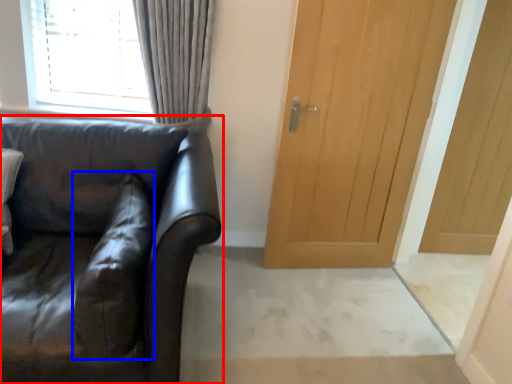
Question: Among these objects, which one is nearest to the camera, studio couch (highlighted by a red box) or pillow (highlighted by a blue box)?

Choices:
 (A) studio couch
 (B) pillow

Answer: (A)